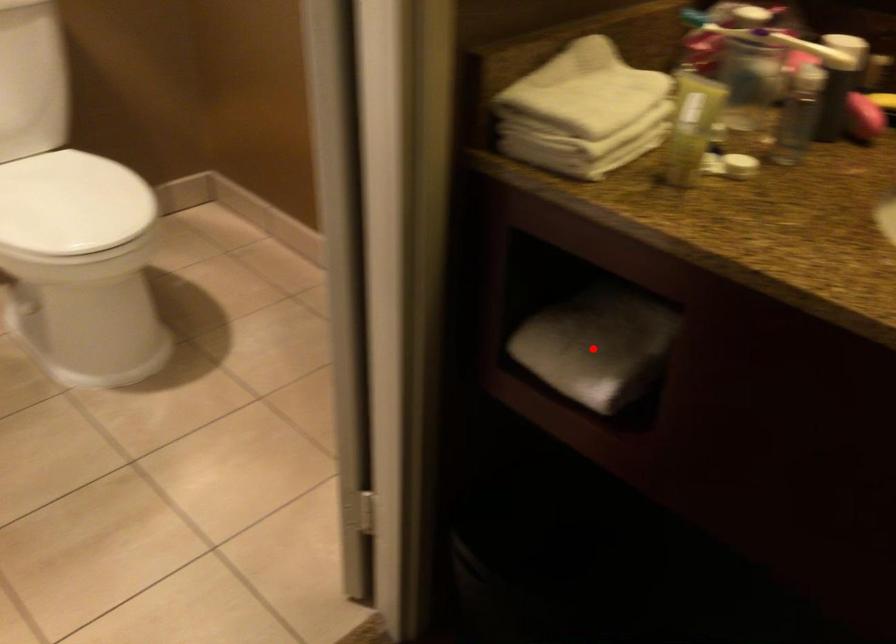
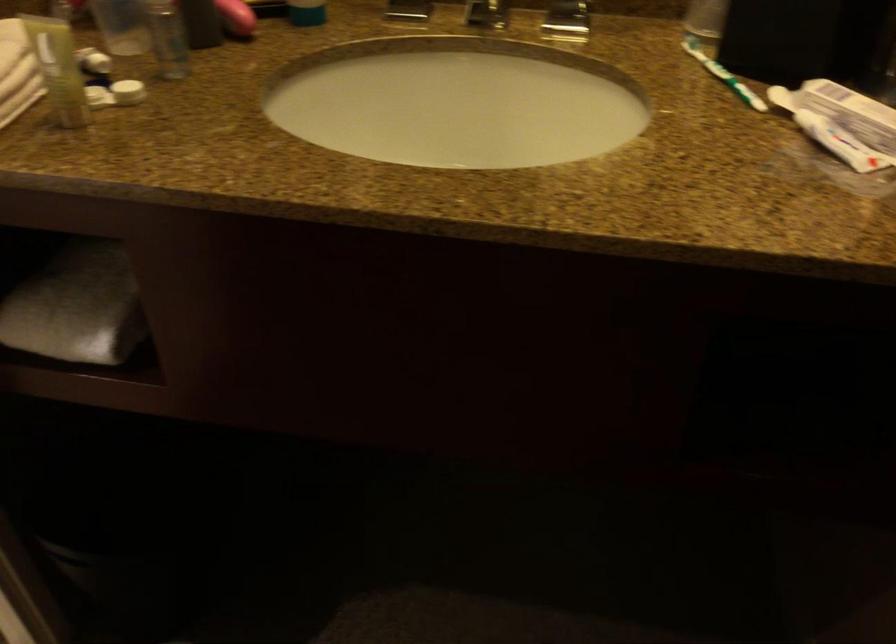
Question: I am providing you with two images of the same scene from different viewpoints. A red point is marked on the first image. Can you still see the location of the red point in image 2?

Choices:
 (A) Yes
 (B) No

Answer: (A)